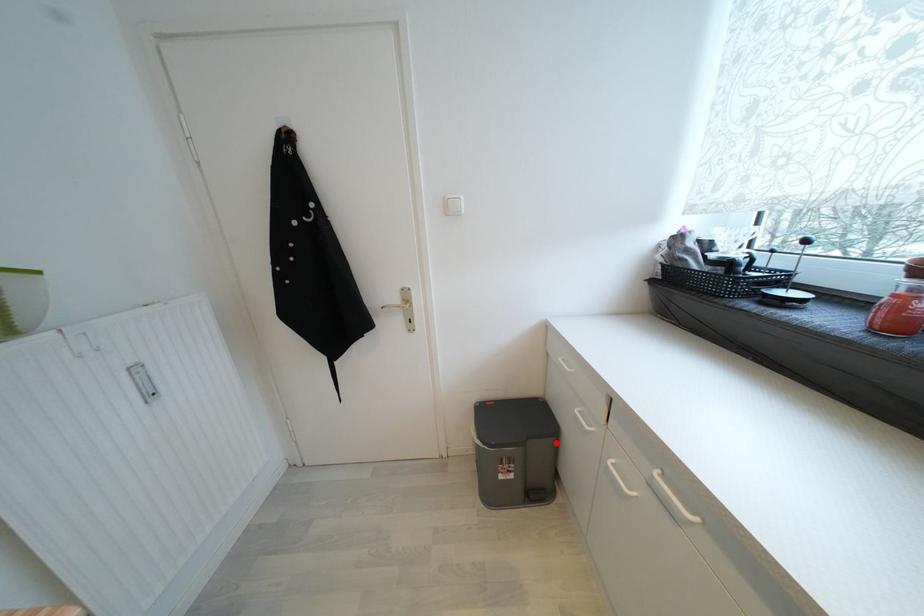
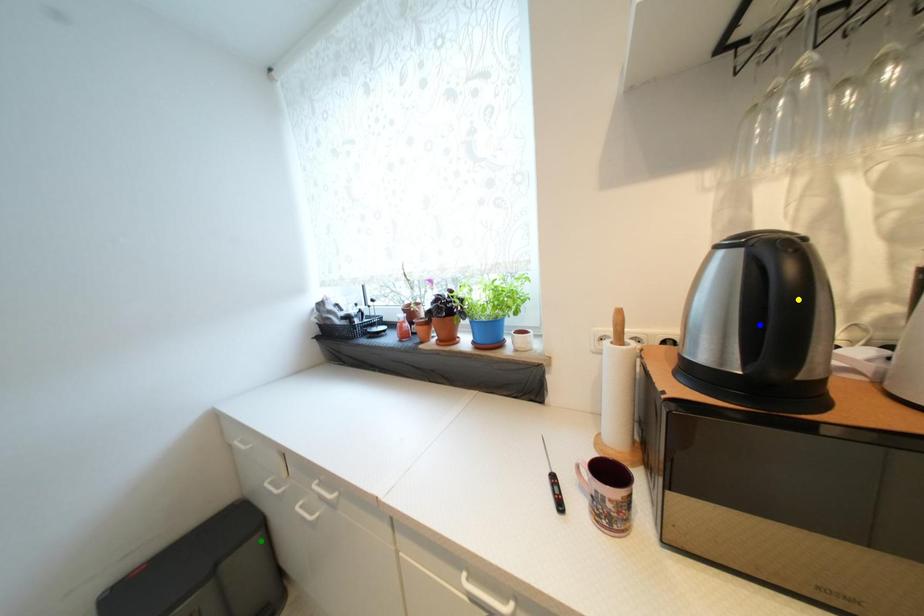
Question: I am providing you with two images of the same scene from different viewpoints. A red point is marked on the first image. You are given multiple points on the second image. In image 2, which mark is for the same physical point as the one in image 1?

Choices:
 (A) blue point
 (B) yellow point
 (C) green point

Answer: (C)